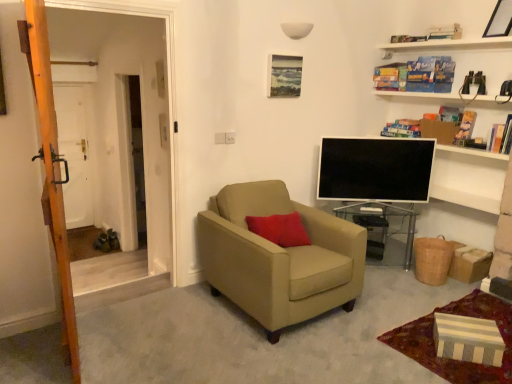
Image resolution: width=512 pixels, height=384 pixels. Find the location of `vacant area located to the right-hand side of wooden ladder at left`. vacant area located to the right-hand side of wooden ladder at left is located at coordinates (150, 339).